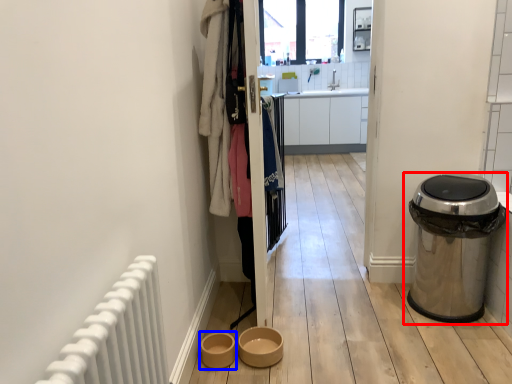
Question: Which object is further to the camera taking this photo, waste container (highlighted by a red box) or toilet bowl (highlighted by a blue box)?

Choices:
 (A) waste container
 (B) toilet bowl

Answer: (B)